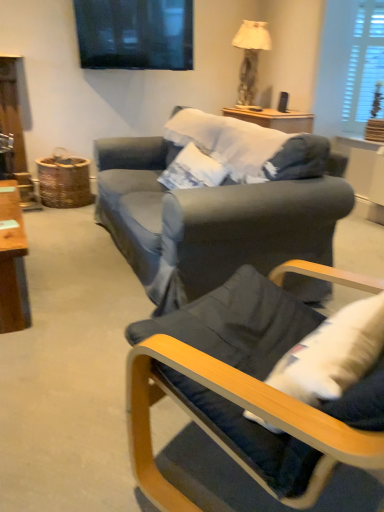
Question: Considering the positions of dark blue fabric chair at lower right and matte beige lampshade at upper right in the image, is dark blue fabric chair at lower right wider or thinner than matte beige lampshade at upper right?

Choices:
 (A) thin
 (B) wide

Answer: (A)

Question: Is dark blue fabric chair at lower right bigger or smaller than matte beige lampshade at upper right?

Choices:
 (A) big
 (B) small

Answer: (B)

Question: Which object is the closest to the dark blue fabric chair at lower right?

Choices:
 (A) matte beige lampshade at upper right
 (B) white wooden blinds at upper right

Answer: (A)

Question: Which object is positioned closest to the matte beige lampshade at upper right?

Choices:
 (A) dark blue fabric chair at lower right
 (B) white wooden blinds at upper right

Answer: (B)